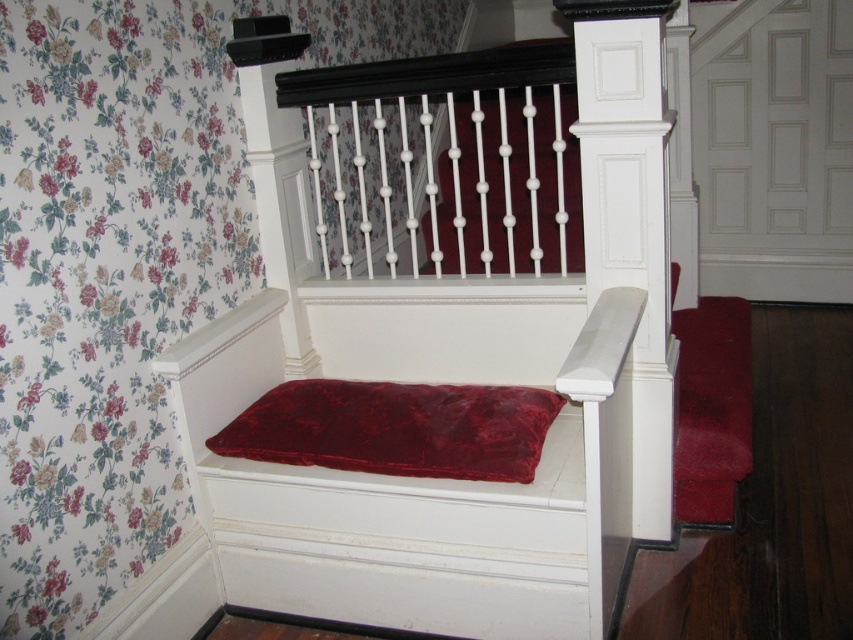
You are sitting on the bench and want to place both the velvet cushion at center and the velvet red pillow at center on the bench. Which one should you place first if you want the taller item to be at the back?

The velvet cushion at center is much taller than the velvet red pillow at center, so you should place the velvet cushion at center first at the back to ensure it is positioned correctly.

You are sitting on the bench and want to grab the closest item from the velvet cushion at center and the velvet red pillow at center. Which one can you reach without moving your body?

The velvet cushion at center is closer to the viewer than the velvet red pillow at center, so you can reach the velvet cushion at center without moving your body.